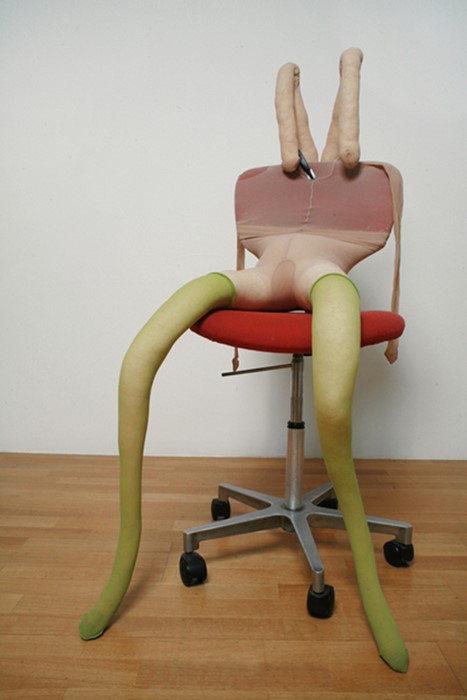
Where is `place to sit on`? place to sit on is located at coordinates (286, 334).